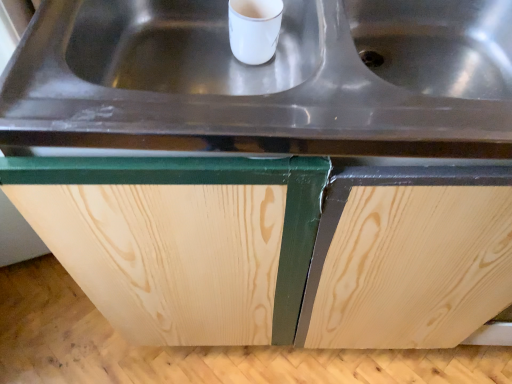
Question: Is natural wood cabinet at center oriented towards stainless steel sink at center?

Choices:
 (A) yes
 (B) no

Answer: (B)

Question: Is natural wood cabinet at center positioned behind stainless steel sink at center?

Choices:
 (A) yes
 (B) no

Answer: (A)

Question: From the image's perspective, is natural wood cabinet at center located beneath stainless steel sink at center?

Choices:
 (A) no
 (B) yes

Answer: (B)

Question: Considering the relative sizes of natural wood cabinet at center and stainless steel sink at center in the image provided, is natural wood cabinet at center bigger than stainless steel sink at center?

Choices:
 (A) yes
 (B) no

Answer: (A)

Question: From the image's perspective, is natural wood cabinet at center on top of stainless steel sink at center?

Choices:
 (A) no
 (B) yes

Answer: (A)

Question: Is natural wood cabinet at center taller than stainless steel sink at center?

Choices:
 (A) no
 (B) yes

Answer: (B)

Question: Can you confirm if stainless steel sink at center is smaller than natural wood cabinet at center?

Choices:
 (A) yes
 (B) no

Answer: (A)

Question: From a real-world perspective, is stainless steel sink at center located beneath natural wood cabinet at center?

Choices:
 (A) yes
 (B) no

Answer: (B)

Question: Can you confirm if stainless steel sink at center is shorter than natural wood cabinet at center?

Choices:
 (A) no
 (B) yes

Answer: (B)

Question: Is stainless steel sink at center next to natural wood cabinet at center?

Choices:
 (A) yes
 (B) no

Answer: (B)

Question: Is stainless steel sink at center facing towards natural wood cabinet at center?

Choices:
 (A) yes
 (B) no

Answer: (A)

Question: Is stainless steel sink at center positioned before natural wood cabinet at center?

Choices:
 (A) no
 (B) yes

Answer: (B)

Question: From the image's perspective, is natural wood cabinet at center located above or below stainless steel sink at center?

Choices:
 (A) above
 (B) below

Answer: (B)